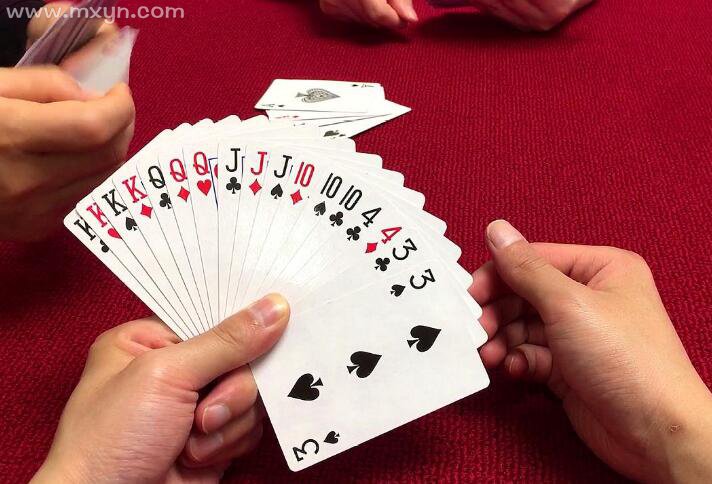
Locate an element on the screen. The image size is (712, 484). red table cloth is located at coordinates (600, 173).